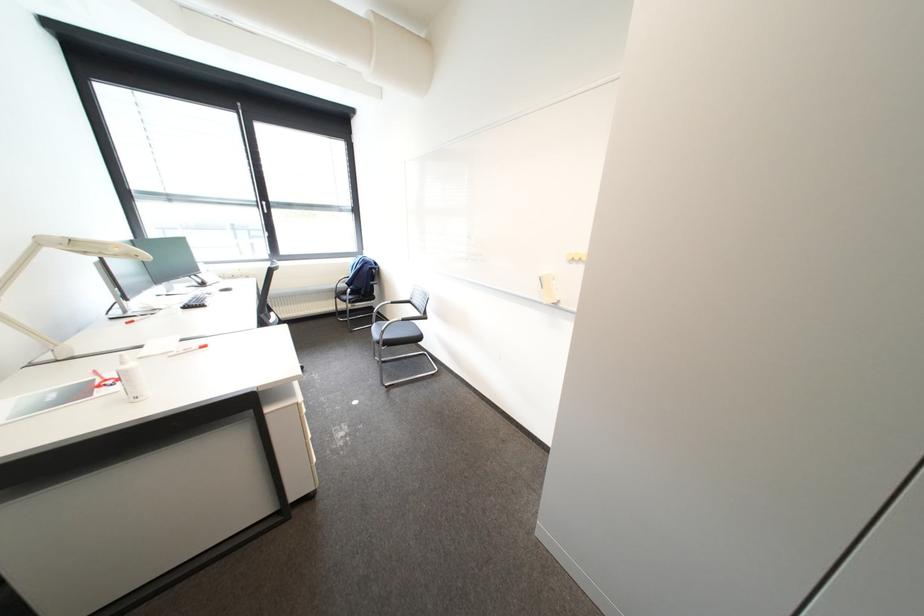
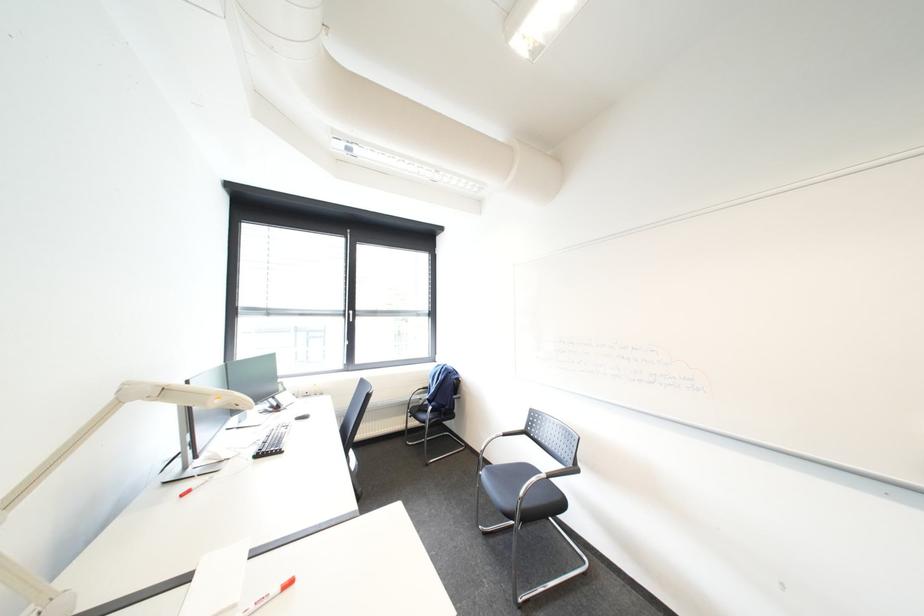
Which direction would the cameraman need to move to produce the second image?

The cameraman walked toward left, forward.